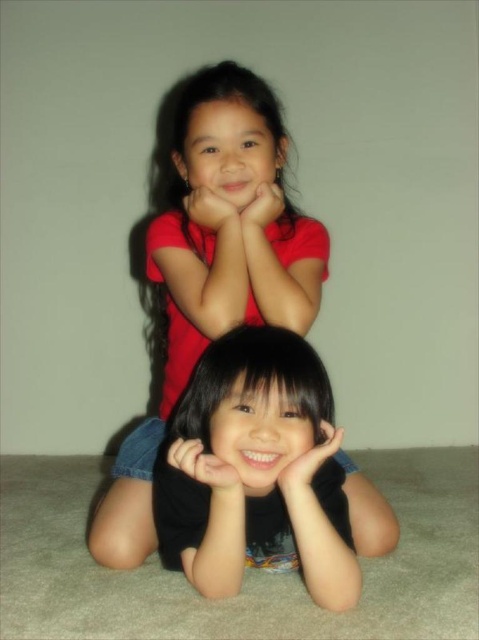
Question: Is matte red shirt at upper center closer to camera compared to matte red hand at center?

Choices:
 (A) no
 (B) yes

Answer: (B)

Question: Does matte red shirt at upper center come in front of smooth skin hand at lower center?

Choices:
 (A) yes
 (B) no

Answer: (B)

Question: Which of these objects is positioned closest to the matte red shirt at upper center?

Choices:
 (A) black matte hair at lower center
 (B) matte red hand at center
 (C) smooth skin hand at lower center
 (D) matte skin hand at center

Answer: (B)

Question: Among these objects, which one is nearest to the camera?

Choices:
 (A) matte red hand at center
 (B) matte skin hand at center
 (C) black matte hair at lower center

Answer: (C)

Question: Which point is farther to the camera?

Choices:
 (A) (187, 458)
 (B) (157, 500)

Answer: (B)

Question: Does black matte hair at lower center appear over black matte hand at lower center?

Choices:
 (A) no
 (B) yes

Answer: (A)